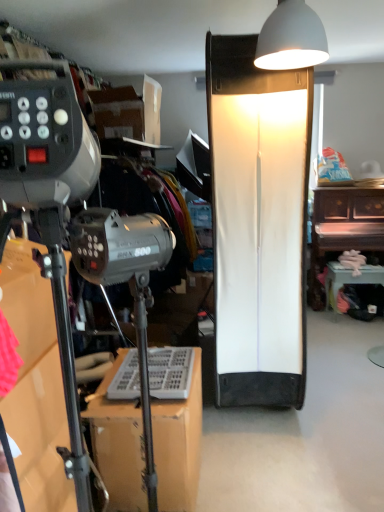
Question: Can you confirm if white matte lampshade at upper center, placed as the first lamp when sorted from front to back, is wider than metallic silver tripod at lower left, which is the 3th furniture from back to front?

Choices:
 (A) no
 (B) yes

Answer: (A)

Question: Does white matte lampshade at upper center, acting as the 1th lamp starting from the top, lie in front of metallic silver tripod at lower left, marked as the third furniture in a right-to-left arrangement?

Choices:
 (A) no
 (B) yes

Answer: (A)

Question: From a real-world perspective, is white matte lampshade at upper center, the second lamp in the bottom-to-top sequence, physically above metallic silver tripod at lower left, the 1th furniture in the left-to-right sequence?

Choices:
 (A) yes
 (B) no

Answer: (A)

Question: From the image's perspective, is white matte lampshade at upper center, acting as the 1th lamp starting from the top, above metallic silver tripod at lower left, marked as the first furniture in a front-to-back arrangement?

Choices:
 (A) no
 (B) yes

Answer: (B)

Question: Are white matte lampshade at upper center, the second lamp when ordered from back to front, and metallic silver tripod at lower left, the 1th furniture in the left-to-right sequence, far apart?

Choices:
 (A) yes
 (B) no

Answer: (A)

Question: In terms of width, does white matte lampshade at center, which is counted as the first lamp, starting from the back, look wider or thinner when compared to white glossy table at lower right, the second furniture in the back-to-front sequence?

Choices:
 (A) wide
 (B) thin

Answer: (A)

Question: Is point (216, 144) closer or farther from the camera than point (382, 280)?

Choices:
 (A) closer
 (B) farther

Answer: (A)

Question: From the image's perspective, is white matte lampshade at center, which is counted as the first lamp, starting from the back, above or below white glossy table at lower right, the second furniture in the right-to-left sequence?

Choices:
 (A) below
 (B) above

Answer: (B)

Question: From a real-world perspective, is white matte lampshade at center, which is counted as the second lamp, starting from the front, above or below white glossy table at lower right, the second furniture in the right-to-left sequence?

Choices:
 (A) above
 (B) below

Answer: (A)

Question: Considering the positions of wooden piano at right, placed as the third furniture when sorted from left to right, and metallic silver tripod at lower left, marked as the third furniture in a right-to-left arrangement, in the image, is wooden piano at right, placed as the third furniture when sorted from left to right, taller or shorter than metallic silver tripod at lower left, marked as the third furniture in a right-to-left arrangement,?

Choices:
 (A) tall
 (B) short

Answer: (A)

Question: Visually, is wooden piano at right, placed as the third furniture when sorted from left to right, positioned to the left or to the right of metallic silver tripod at lower left, marked as the first furniture in a front-to-back arrangement?

Choices:
 (A) right
 (B) left

Answer: (A)

Question: Relative to metallic silver tripod at lower left, which is the 3th furniture from back to front, is wooden piano at right, placed as the third furniture when sorted from left to right, in front or behind?

Choices:
 (A) behind
 (B) front

Answer: (A)

Question: From the image's perspective, is wooden piano at right, the first furniture in the right-to-left sequence, above or below metallic silver tripod at lower left, marked as the third furniture in a right-to-left arrangement?

Choices:
 (A) above
 (B) below

Answer: (A)

Question: In terms of size, does white matte lampshade at upper center, the second lamp when ordered from back to front, appear bigger or smaller than wooden piano at right, the first furniture in the right-to-left sequence?

Choices:
 (A) small
 (B) big

Answer: (A)

Question: Does point (284, 11) appear closer or farther from the camera than point (357, 211)?

Choices:
 (A) closer
 (B) farther

Answer: (A)